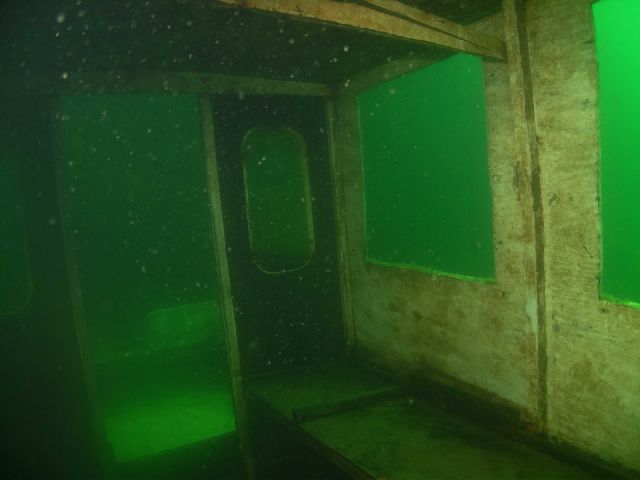
Where is `windows`? The height and width of the screenshot is (480, 640). windows is located at coordinates (443, 209), (614, 215), (272, 236), (12, 284).